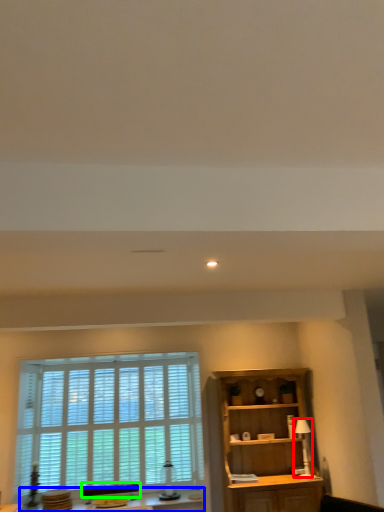
Question: Which is nearer to the lamp (highlighted by a red box)? table (highlighted by a blue box) or swivel chair (highlighted by a green box).

Choices:
 (A) table
 (B) swivel chair

Answer: (A)